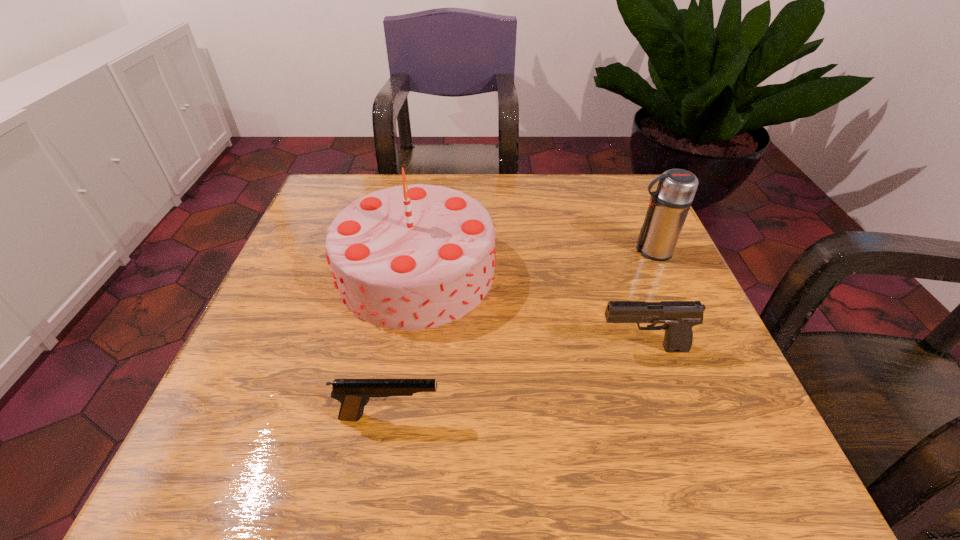
The width and height of the screenshot is (960, 540). What are the coordinates of `free spot between the second shortest object and the thermos bottle` in the screenshot? It's located at (647, 300).

At what (x,y) coordinates should I click in order to perform the action: click on empty space that is in between the thermos bottle and the birthday cake. Please return your answer as a coordinate pair (x, y). This screenshot has width=960, height=540. Looking at the image, I should click on (534, 261).

This screenshot has height=540, width=960. I want to click on vacant point located between the left pistol and the third tallest object, so click(x=516, y=382).

I want to click on empty space that is in between the second tallest object and the shorter pistol, so click(x=520, y=333).

Where is `free spot between the taller pistol and the tallest object`? free spot between the taller pistol and the tallest object is located at coordinates (529, 310).

Find the location of a particular element. This screenshot has height=540, width=960. vacant area that lies between the third shortest object and the birthday cake is located at coordinates (534, 261).

Point out which object is positioned as the second nearest to the tallest object. Please provide its 2D coordinates. Your answer should be formatted as a tuple, i.e. [(x, y)], where the tuple contains the x and y coordinates of a point satisfying the conditions above.

[(679, 317)]

You are a GUI agent. You are given a task and a screenshot of the screen. Output one action in this format:
    pyautogui.click(x=<x>, y=<y>)
    Task: Click on the object that is the third closest to the thermos bottle
    This screenshot has width=960, height=540.
    Given the screenshot: What is the action you would take?
    pyautogui.click(x=353, y=394)

This screenshot has width=960, height=540. Identify the location of free location that satisfies the following two spatial constraints: 1. on the front side of the tallest object; 2. at the muzzle of the nearest object. (394, 416).

Where is `free space that satisfies the following two spatial constraints: 1. on the front side of the birthday cake; 2. at the muzzle of the nearer pistol`? This screenshot has width=960, height=540. free space that satisfies the following two spatial constraints: 1. on the front side of the birthday cake; 2. at the muzzle of the nearer pistol is located at coordinates (394, 416).